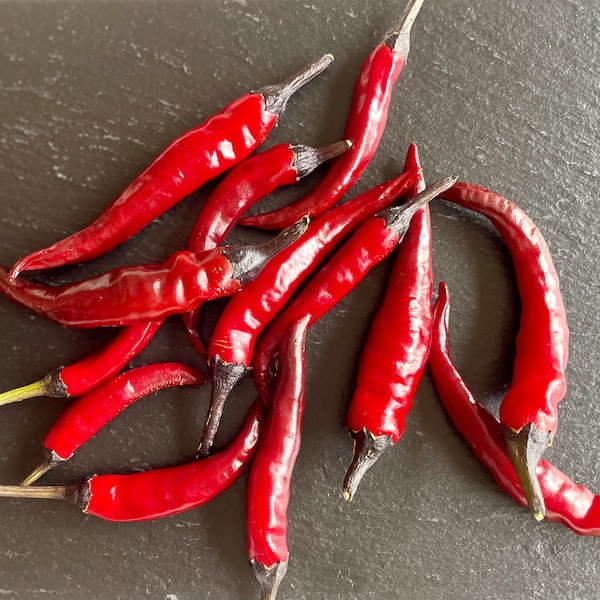
You are a GUI agent. You are given a task and a screenshot of the screen. Output one action in this format:
    pyautogui.click(x=<x>, y=<y>)
    Task: Click on the grey countertop
    
    Given the screenshot: What is the action you would take?
    pyautogui.click(x=498, y=134)